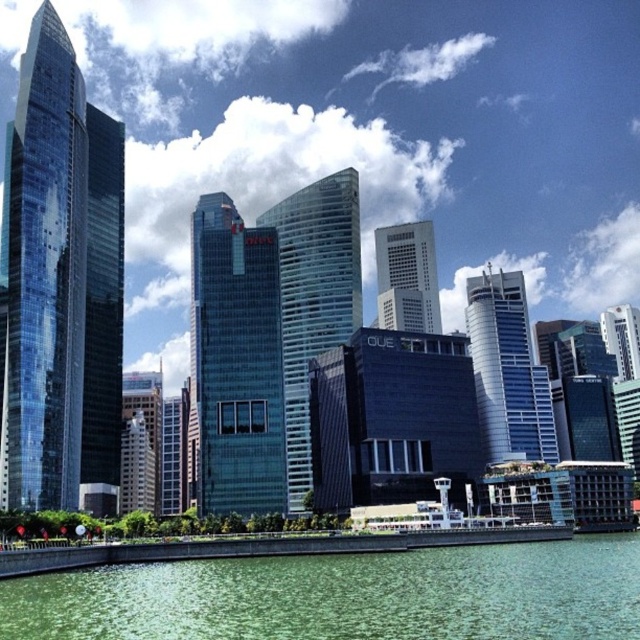
You are a drone operator trying to capture aerial footage of the city. You need to fly your drone from the glassy reflective skyscraper at center to the glassy reflective skyscraper at left. Which direction should you fly to reach the taller building?

The glassy reflective skyscraper at left is taller than the glassy reflective skyscraper at center. So, you should fly towards the left to reach the taller building.

You are standing on a bridge overlooking the city and see the green water at lower center and the shiny glass skyscraper at left. Which object is located to the right of the other?

The green water at lower center is positioned on the right side of the shiny glass skyscraper at left.

Consider the image. You are a drone operator who needs to fly your drone from the green water at lower center to the shiny glass skyscraper at left. Considering the height restrictions, will your drone be able to reach the skyscraper without hitting any obstacles?

The green water at lower center is not as tall as the shiny glass skyscraper at left, so the drone can safely fly from the green water at lower center to the shiny glass skyscraper at left without hitting obstacles since the skyscraper is taller.